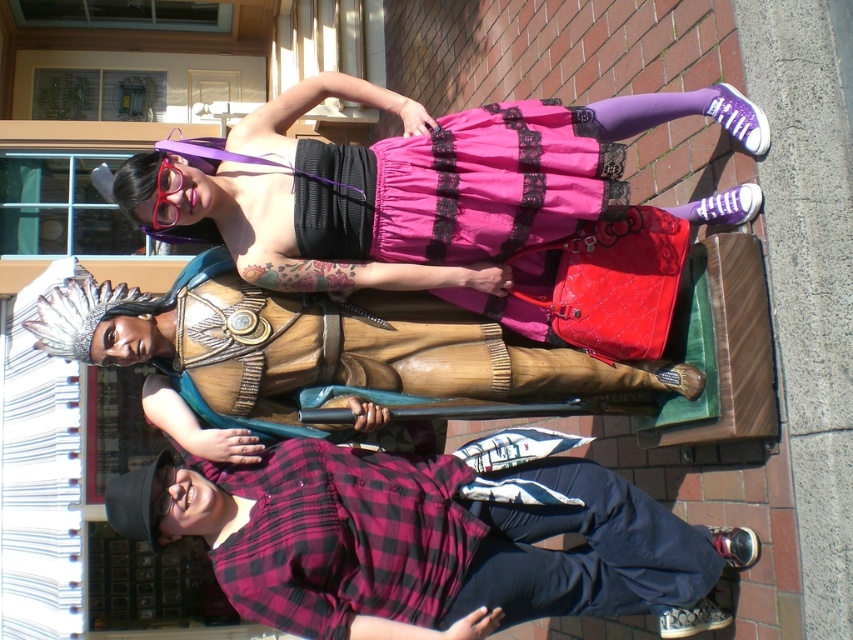
How distant is plaid flannel shirt at lower left from wooden statue at center?

plaid flannel shirt at lower left and wooden statue at center are 29.10 inches apart.

Is plaid flannel shirt at lower left smaller than wooden statue at center?

Incorrect, plaid flannel shirt at lower left is not smaller in size than wooden statue at center.

This screenshot has height=640, width=853. In order to click on plaid flannel shirt at lower left in this screenshot , I will do `click(427, 541)`.

What are the coordinates of `plaid flannel shirt at lower left` in the screenshot? It's located at (427, 541).

From the picture: Does pink satin skirt at upper center have a lesser height compared to wooden statue at center?

No.

How much distance is there between pink satin skirt at upper center and wooden statue at center?

27.60 inches

Identify the location of pink satin skirt at upper center. The image size is (853, 640). (415, 192).

At what (x,y) coordinates should I click in order to perform the action: click on pink satin skirt at upper center. Please return your answer as a coordinate pair (x, y). Looking at the image, I should click on (415, 192).

Which is in front, point (258, 566) or point (231, 246)?

Point (258, 566)

The image size is (853, 640). I want to click on plaid flannel shirt at lower left, so click(x=427, y=541).